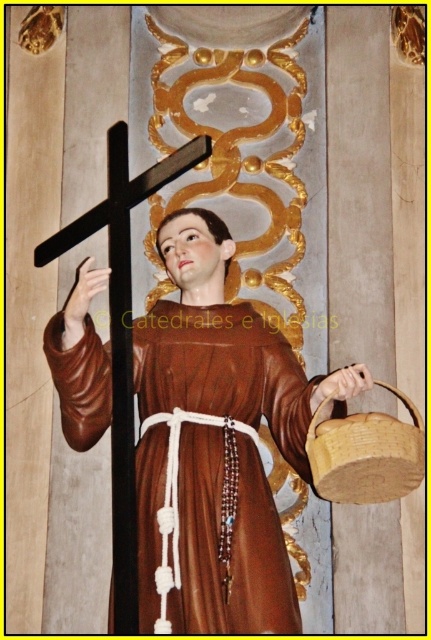
Question: Which point is closer to the camera taking this photo?

Choices:
 (A) click(208, 278)
 (B) click(77, 243)

Answer: (B)

Question: Is brown wooden statue at center wider than brown woven basket at lower right?

Choices:
 (A) yes
 (B) no

Answer: (A)

Question: Can you confirm if black wood cross at left is smaller than brown woven basket at lower right?

Choices:
 (A) yes
 (B) no

Answer: (B)

Question: Which is nearer to the brown woven basket at lower right?

Choices:
 (A) brown wooden statue at center
 (B) black wood cross at left

Answer: (A)

Question: Which object is the closest to the brown woven basket at lower right?

Choices:
 (A) black wood cross at left
 (B) brown wooden statue at center

Answer: (B)

Question: Is black wood cross at left below brown woven basket at lower right?

Choices:
 (A) no
 (B) yes

Answer: (A)